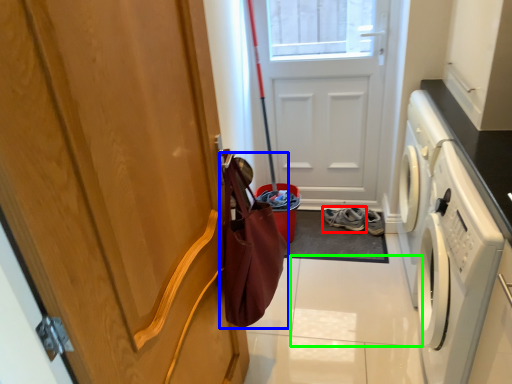
Question: Which object is positioned closest to footwear (highlighted by a red box)? Select from shopping bag (highlighted by a blue box) and tile (highlighted by a green box).

Choices:
 (A) shopping bag
 (B) tile

Answer: (B)